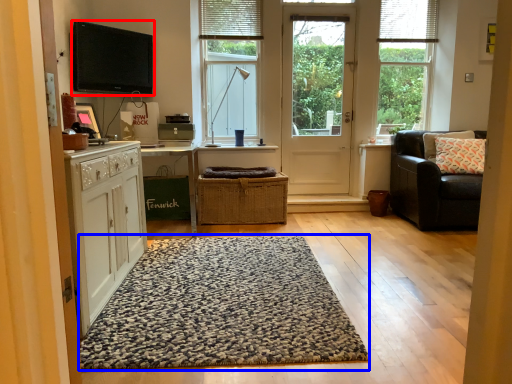
Question: Which object appears closest to the camera in this image, electronic (highlighted by a red box) or doormat (highlighted by a blue box)?

Choices:
 (A) electronic
 (B) doormat

Answer: (B)